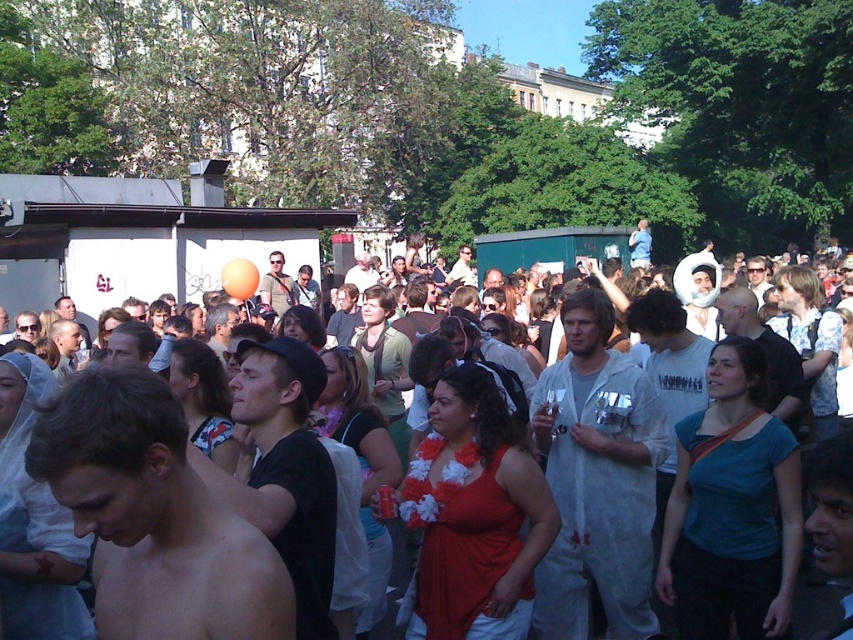
Is point (236, 349) behind point (215, 336)?

No, it is in front of (215, 336).

Is point (236, 508) closer to camera compared to point (213, 308)?

Yes.

Between point (245, 445) and point (212, 312), which one is positioned in front?

Point (245, 445)

What are the coordinates of `black matte shirt at center` in the screenshot? It's located at (283, 470).

Who is lower down, light blue shirt at center or white cotton shirt at center?

white cotton shirt at center is below.

Looking at this image, can you confirm if light blue shirt at center is taller than white cotton shirt at center?

Incorrect, light blue shirt at center's height is not larger of white cotton shirt at center's.

Who is more forward, (637, 264) or (355, 276)?

Point (355, 276) is in front.

The image size is (853, 640). In order to click on light blue shirt at center in this screenshot , I will do `click(640, 244)`.

Is white paper suit at center closer to the viewer compared to black matte shirt at center?

No, it is behind black matte shirt at center.

Between white paper suit at center and black matte shirt at center, which one has less height?

With less height is white paper suit at center.

Find the location of `white paper suit at center`. white paper suit at center is located at coordinates (596, 480).